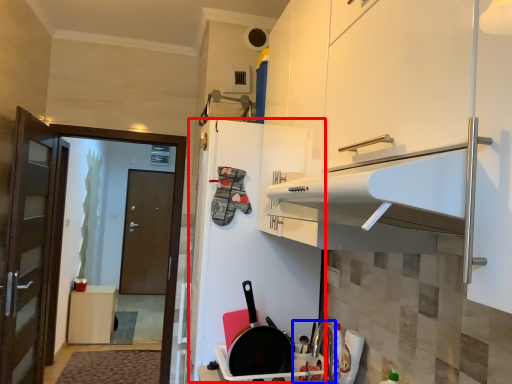
Question: Which object is further to the camera taking this photo, fridge (highlighted by a red box) or sink (highlighted by a blue box)?

Choices:
 (A) fridge
 (B) sink

Answer: (A)